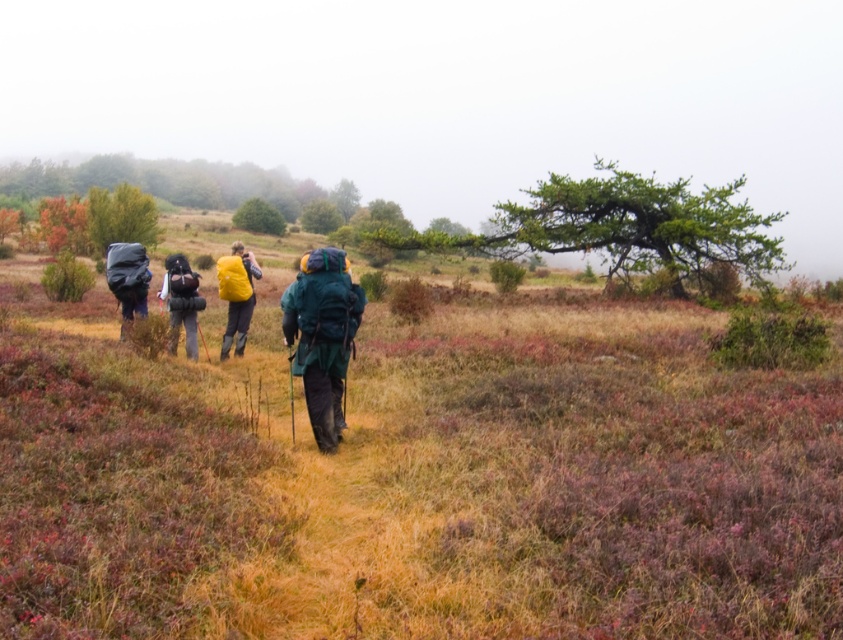
Question: Where is green grass at center located in relation to green fabric backpack at center in the image?

Choices:
 (A) left
 (B) right

Answer: (A)

Question: Among these objects, which one is nearest to the camera?

Choices:
 (A) green grass at center
 (B) matte yellow backpack at center

Answer: (A)

Question: Does green grass at center have a larger size compared to matte black backpack at center?

Choices:
 (A) yes
 (B) no

Answer: (A)

Question: Considering the real-world distances, which object is closest to the matte black backpack at left?

Choices:
 (A) matte yellow backpack at center
 (B) matte black backpack at center

Answer: (B)

Question: Does green fabric backpack at center have a lesser width compared to matte yellow backpack at center?

Choices:
 (A) yes
 (B) no

Answer: (A)

Question: Estimate the real-world distances between objects in this image. Which object is closer to the green fabric backpack at center?

Choices:
 (A) matte black backpack at left
 (B) matte yellow backpack at center
 (C) matte black backpack at center
 (D) green grass at center

Answer: (C)